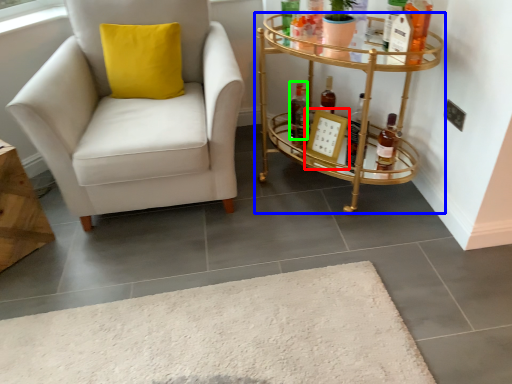
Question: Which object is positioned closest to picture frame (highlighted by a red box)? Select from table (highlighted by a blue box) and bottle (highlighted by a green box).

Choices:
 (A) table
 (B) bottle

Answer: (B)